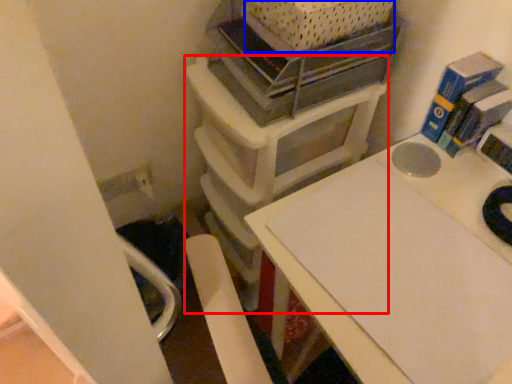
Question: Among these objects, which one is nearest to the camera, furniture (highlighted by a red box) or crate (highlighted by a blue box)?

Choices:
 (A) furniture
 (B) crate

Answer: (B)